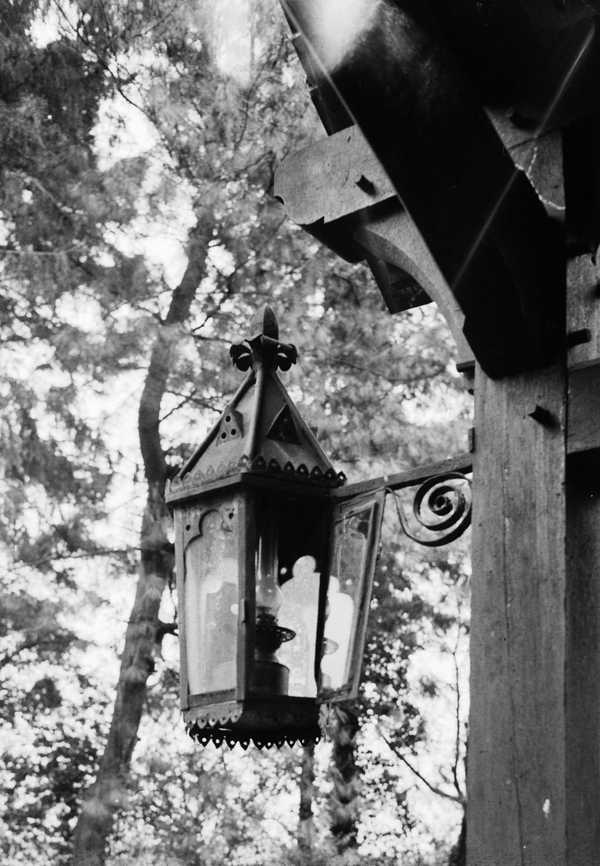
Identify the location of wood beam. The height and width of the screenshot is (866, 600). (540, 667).